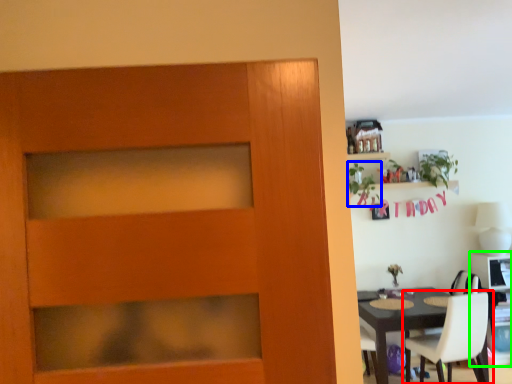
Question: Considering the real-world distances, which object is farthest from chair (highlighted by a red box)? plant (highlighted by a blue box) or computer desk (highlighted by a green box)?

Choices:
 (A) plant
 (B) computer desk

Answer: (A)